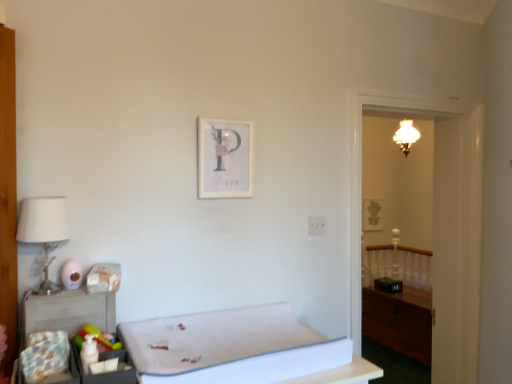
Question: Based on their positions, is wooden chest at right located to the left or right of matte white lampshade at upper right?

Choices:
 (A) left
 (B) right

Answer: (A)

Question: From the image's perspective, is wooden chest at right located above or below matte white lampshade at upper right?

Choices:
 (A) above
 (B) below

Answer: (B)

Question: Which object is the closest to the white fabric lampshade at left?

Choices:
 (A) wooden chest at right
 (B) wooden table at lower left
 (C) wooden armoire at left
 (D) white foam mattress at lower center
 (E) matte paper picture frame at upper center, which is the second picture frame from right to left

Answer: (B)

Question: Which of these objects is positioned closest to the wooden table at lower left?

Choices:
 (A) matte white lampshade at upper right
 (B) matte paper picture frame at upper center, which is the second picture frame from right to left
 (C) dark wood vanity at right
 (D) wooden chest at right
 (E) white fabric lampshade at left

Answer: (E)